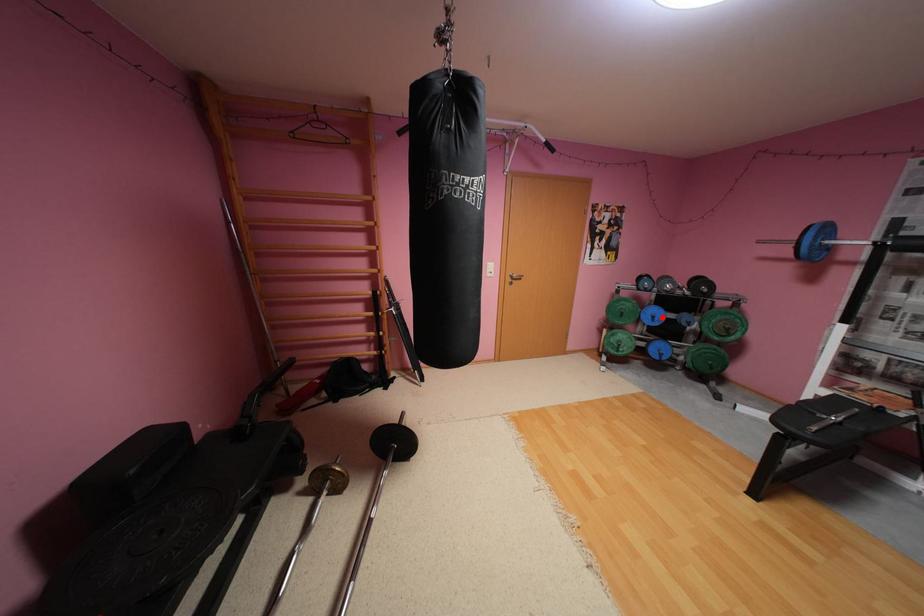
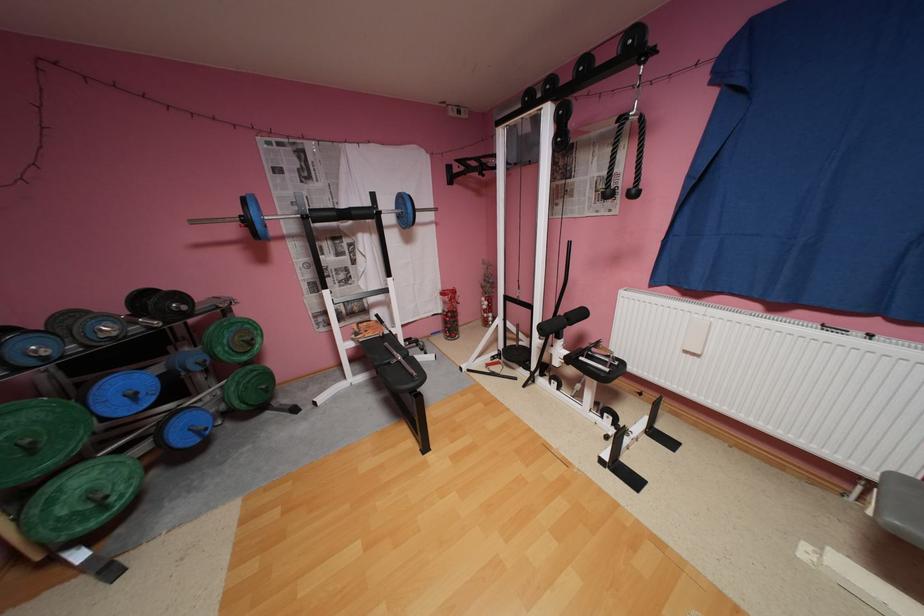
The point at the highlighted location is marked in the first image. Where is the corresponding point in the second image?

(142, 395)